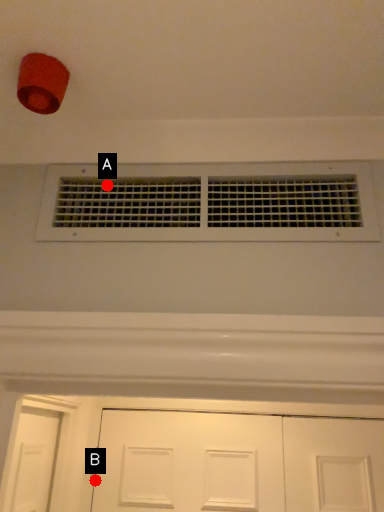
Question: Two points are circled on the image, labeled by A and B beside each circle. Which point is farther to the camera?

Choices:
 (A) A is further
 (B) B is further

Answer: (B)